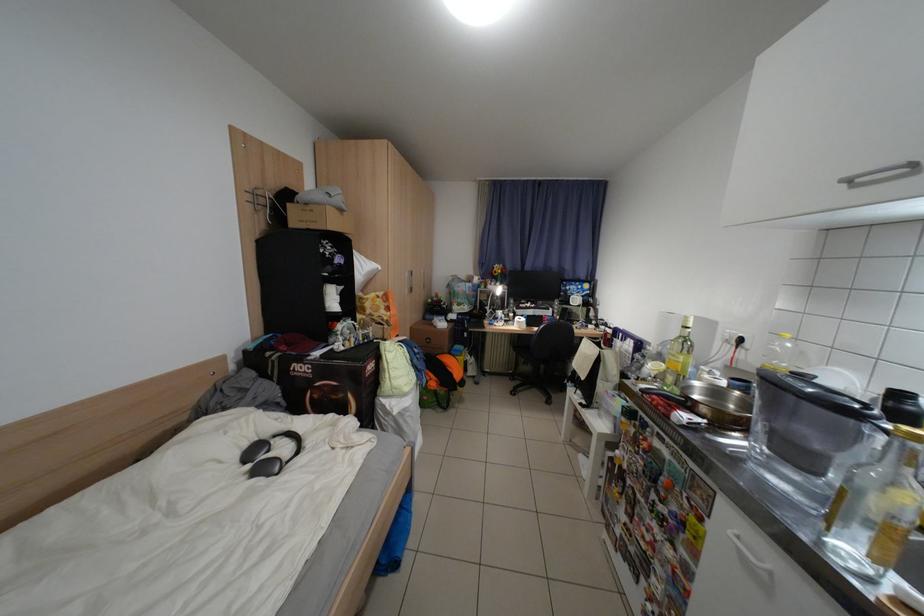
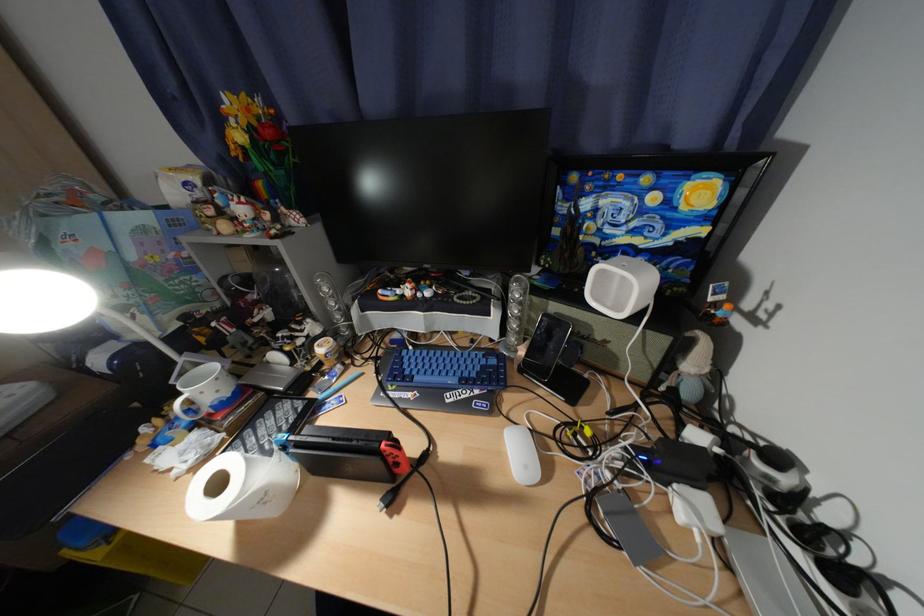
Find the pixel in the second image that matches (602,328) in the first image.

(700, 508)